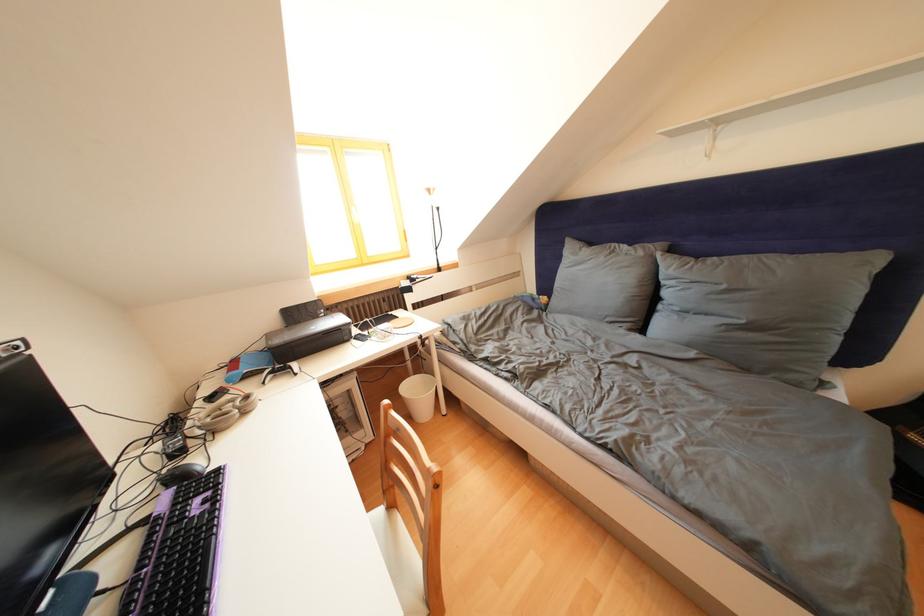
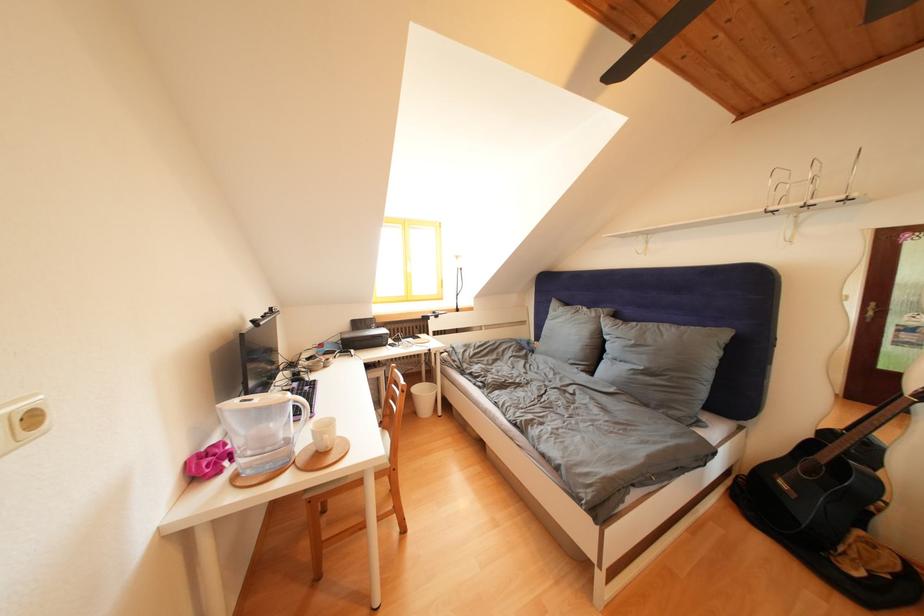
Find the pixel in the second image that matches the point at 649,259 in the first image.

(602, 320)